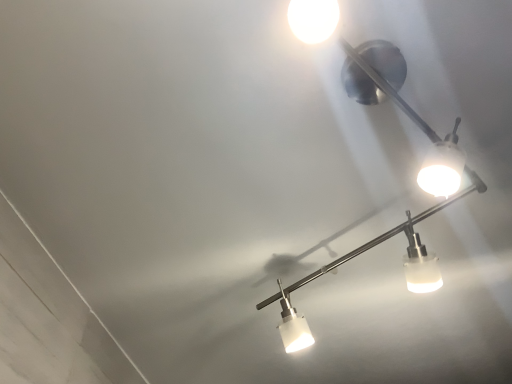
The width and height of the screenshot is (512, 384). Describe the element at coordinates (399, 225) in the screenshot. I see `matte white track light at upper right` at that location.

You are a GUI agent. You are given a task and a screenshot of the screen. Output one action in this format:
    pyautogui.click(x=<x>, y=<y>)
    Task: Click on the matte white track light at upper right
    Image resolution: width=512 pixels, height=384 pixels.
    Given the screenshot: What is the action you would take?
    pyautogui.click(x=399, y=225)

Where is `matte white track light at upper right`? matte white track light at upper right is located at coordinates (399, 225).